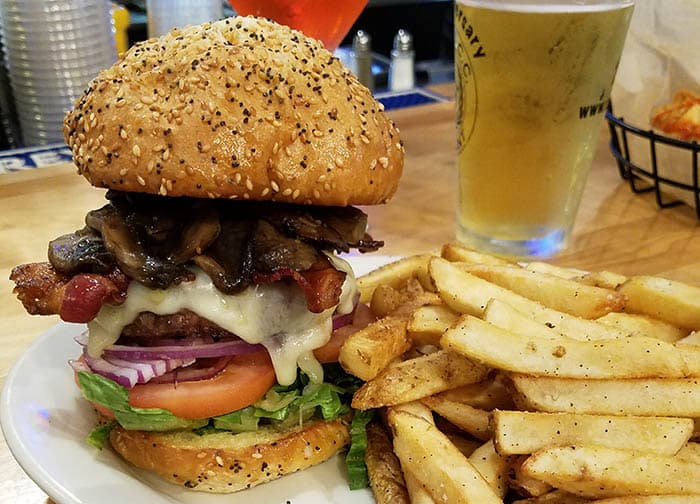
Where is `clear plastic cup`? clear plastic cup is located at coordinates (64, 50).